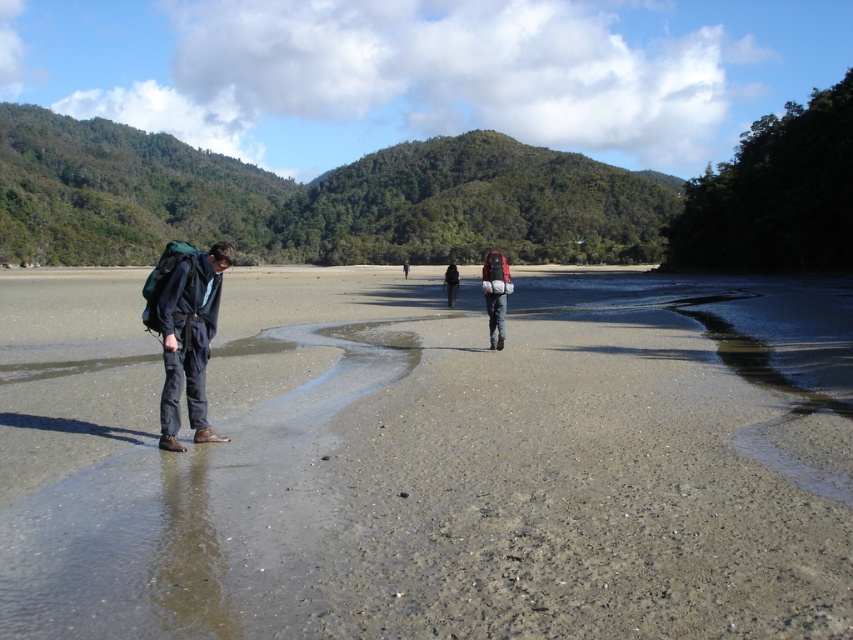
Question: Estimate the real-world distances between objects in this image. Which object is closer to the matte gray backpack at center?

Choices:
 (A) dark gray pants at center
 (B) dark blue fabric pants at left
 (C) matte black backpack at center

Answer: (B)

Question: Which object is farther from the camera taking this photo?

Choices:
 (A) sandy beach at lower left
 (B) dark gray pants at center
 (C) matte black backpack at center
 (D) matte gray backpack at center

Answer: (B)

Question: Is sandy beach at lower left in front of matte gray backpack at center?

Choices:
 (A) no
 (B) yes

Answer: (B)

Question: Considering the relative positions of sandy beach at lower left and dark blue fabric pants at left in the image provided, where is sandy beach at lower left located with respect to dark blue fabric pants at left?

Choices:
 (A) right
 (B) left

Answer: (B)

Question: Which object appears farthest from the camera in this image?

Choices:
 (A) dark blue fabric pants at left
 (B) matte black backpack at center

Answer: (B)

Question: Considering the relative positions of dark blue fabric pants at left and matte gray backpack at center in the image provided, where is dark blue fabric pants at left located with respect to matte gray backpack at center?

Choices:
 (A) below
 (B) above

Answer: (A)